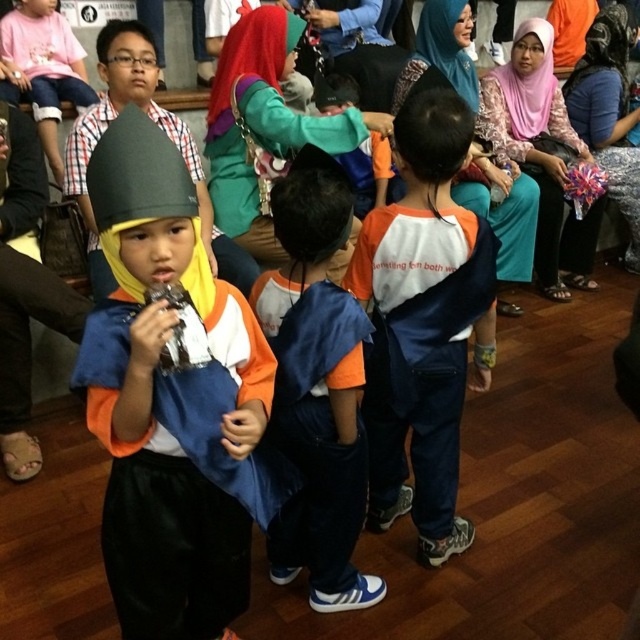
Please provide the 2D coordinates of the matte black helmet at center in the image. The coordinate system is normalized between 0 and 1, with the origin at the bottom left corner.

The matte black helmet at center is located at coordinates 0.619 in the x axis and 0.248 in the y axis.

You are organizing a costume party and need to ensure that all props and clothing items are appropriately sized. You have a matte black helmet at center and an orange cotton shirt at center. Which item requires more space when packing them separately?

The matte black helmet at center requires more space when packing them separately because it is larger in size than the orange cotton shirt at center.